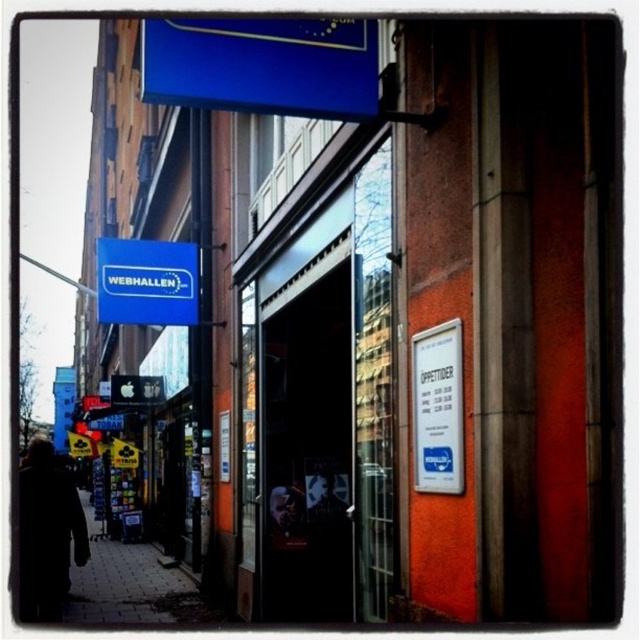
You are standing on the street looking at the store with the orange wall and glass door. There are two points marked on the image. Which point, point (20, 483) or point (177, 252), is closer to you?

Point (20, 483) is closer to the viewer than point (177, 252).

You are a customer entering the store and notice the black coat at lower left and the blue matte sign at upper left. Which object is taller?

The black coat at lower left is taller than the blue matte sign at upper left.

You are standing in front of the WEBHALLEN store and see a black coat at lower left. If you want to pick it up, which direction should you move relative to your current position?

Since the black coat at lower left is located at point 0.833 on the x axis and 0.073 on the y axis, you should move to the lower left direction to reach it.